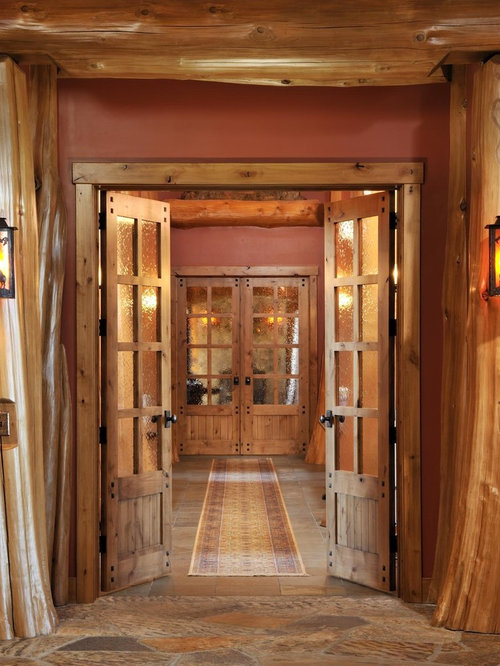
I want to click on closed doors, so click(x=236, y=347), click(x=244, y=348).